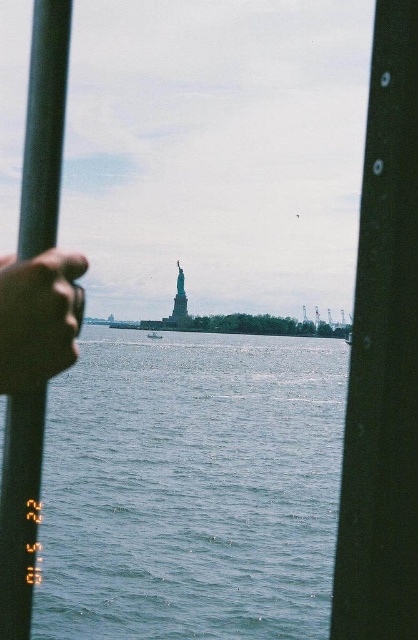
Question: Does smooth skin hand at center left have a lesser width compared to white plastic boat at center?

Choices:
 (A) yes
 (B) no

Answer: (B)

Question: Which of these objects is positioned closest to the white plastic boat at center?

Choices:
 (A) black matte pole at center
 (B) smooth skin hand at center left
 (C) black matte pole at left
 (D) blue water at center

Answer: (D)

Question: Does smooth skin hand at center left appear over white plastic boat at center?

Choices:
 (A) no
 (B) yes

Answer: (B)

Question: In this image, where is blue water at center located relative to white plastic boat at center?

Choices:
 (A) left
 (B) right

Answer: (B)

Question: Which object appears closest to the camera in this image?

Choices:
 (A) white plastic boat at center
 (B) black matte pole at center
 (C) black matte pole at left
 (D) smooth skin hand at center left

Answer: (B)

Question: Which point is farther from the camera taking this photo?

Choices:
 (A) (0, 563)
 (B) (371, 625)
 (C) (153, 333)
 (D) (165, 531)

Answer: (C)